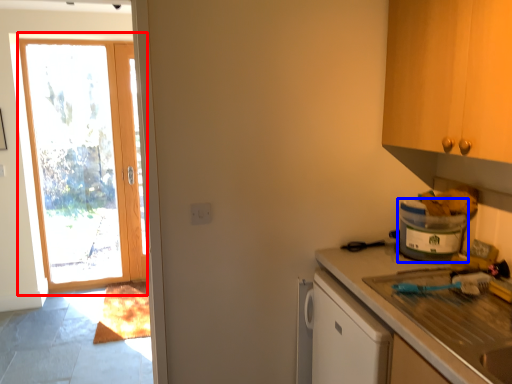
Question: Which object is further to the camera taking this photo, door (highlighted by a red box) or appliance (highlighted by a blue box)?

Choices:
 (A) door
 (B) appliance

Answer: (A)